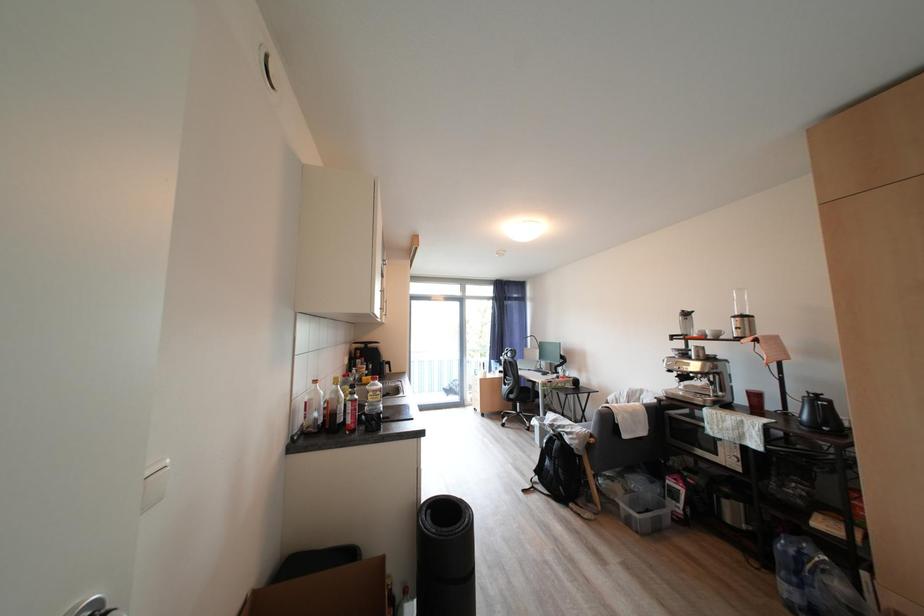
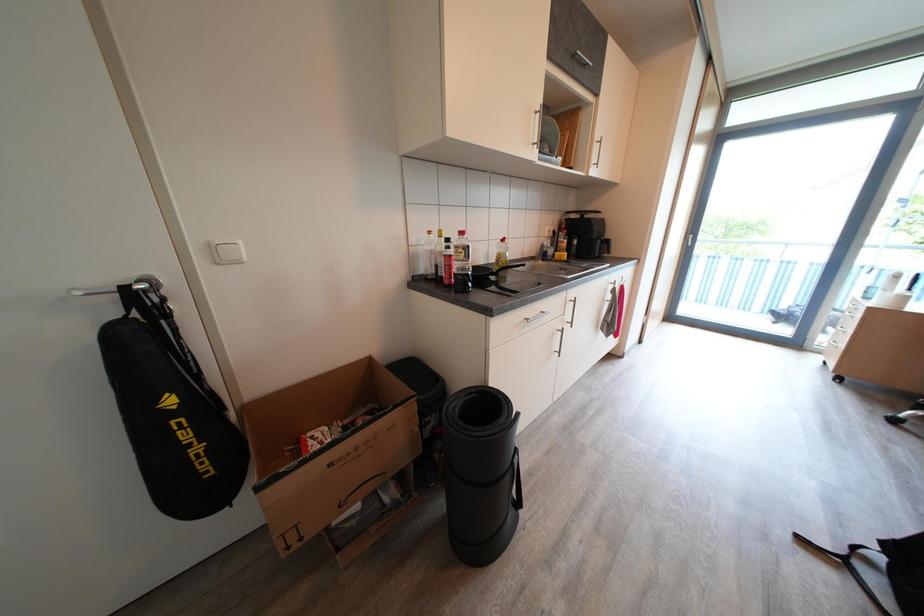
First-person continuous shooting, in which direction is the camera rotating?

The rotation direction of the camera is left-down.